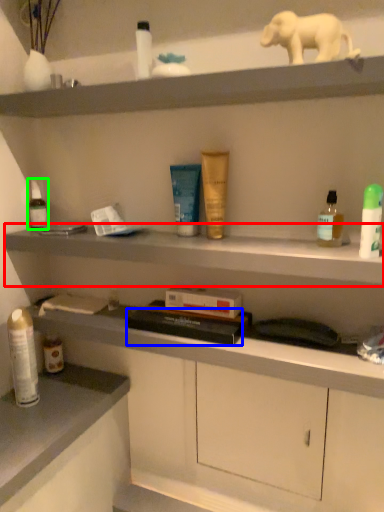
Question: Based on their relative distances, which object is nearer to cabinet (highlighted by a red box)? Choose from book (highlighted by a blue box) and toiletry (highlighted by a green box).

Choices:
 (A) book
 (B) toiletry

Answer: (A)